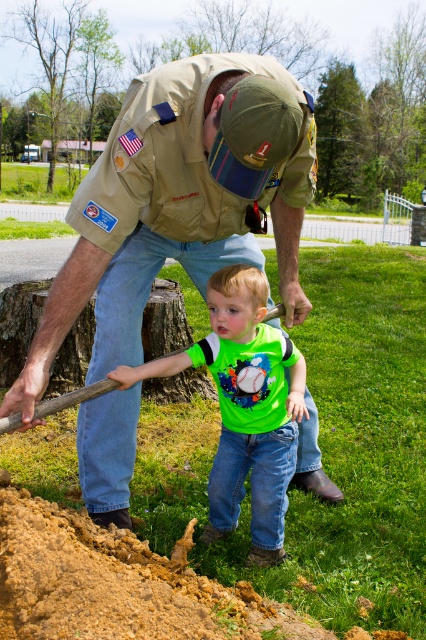
You are a gardener who needs to plant a row of flowers. You have a tool that requires a space wider than the green matte shirt at center. Do you think the brown sandy soil at lower left has enough width for your tool?

The brown sandy soil at lower left might be wider than the green matte shirt at center, so it is possible that the tool requiring more width than the green matte shirt at center could fit in the brown sandy soil at lower left.

You are standing at point [63,570] in the garden scene. If you want to take a photo of the adult and child gardening from a distance of exactly 2.00 meters away, where should you position yourself?

You should position yourself exactly 2.00 meters away from point [63,570] to take the photo. Since the point and the camera are 2.00 meters apart, positioning yourself at that distance will allow you to capture the scene as described.